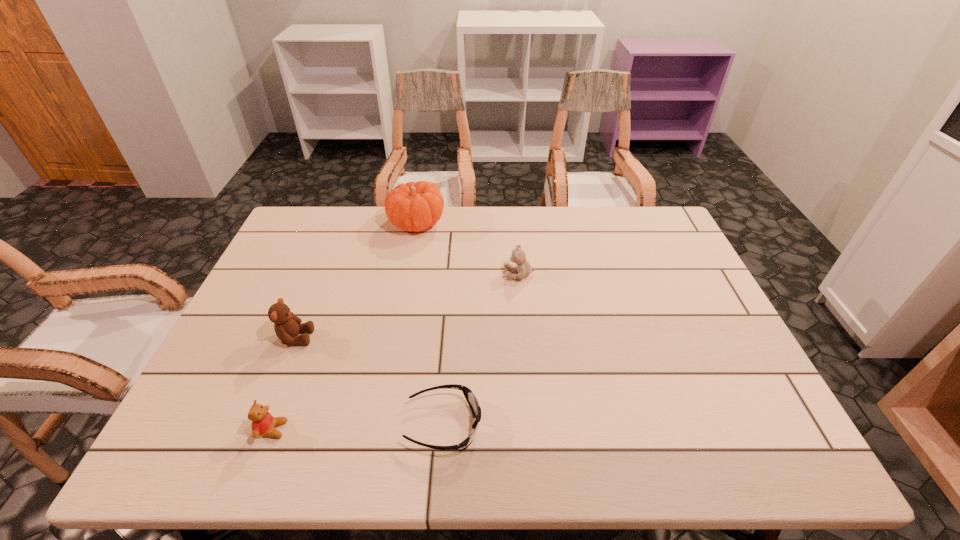
Where is `vacant area at the left edge`? vacant area at the left edge is located at coordinates (277, 367).

The width and height of the screenshot is (960, 540). In the image, there is a desktop. In order to click on free space at the right edge in this screenshot , I will do `click(693, 305)`.

I want to click on vacant space at the far left corner of the desktop, so click(330, 208).

In the image, there is a desktop. In order to click on vacant space at the far right corner in this screenshot , I will do pos(634,217).

Find the location of a particular element. This screenshot has height=540, width=960. vacant area that lies between the nearest teddy bear and the rightmost teddy bear is located at coordinates (396, 352).

Find the location of a particular element. The image size is (960, 540). unoccupied position between the pumpkin and the nearest teddy bear is located at coordinates (345, 326).

The width and height of the screenshot is (960, 540). Find the location of `vacant area between the shortest object and the nearest teddy bear`. vacant area between the shortest object and the nearest teddy bear is located at coordinates (358, 427).

The image size is (960, 540). Identify the location of free point between the tallest teddy bear and the farthest object. (356, 280).

Locate an element on the screen. vacant region between the farthest object and the shortest object is located at coordinates (430, 323).

Identify the location of free space between the nearest teddy bear and the third nearest object. The height and width of the screenshot is (540, 960). (284, 383).